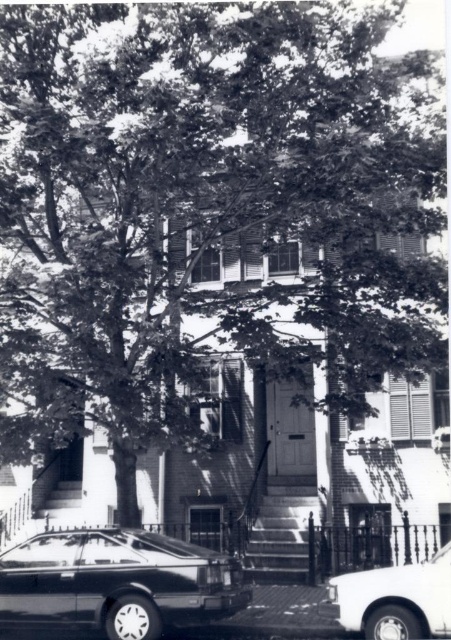
Between shiny black sedan at lower left and white glossy sedan at lower right, which one appears on the right side from the viewer's perspective?

white glossy sedan at lower right

Which of these two, shiny black sedan at lower left or white glossy sedan at lower right, stands taller?

shiny black sedan at lower left

At what (x,y) coordinates should I click in order to perform the action: click on shiny black sedan at lower left. Please return your answer as a coordinate pair (x, y). This screenshot has height=640, width=451. Looking at the image, I should click on (118, 580).